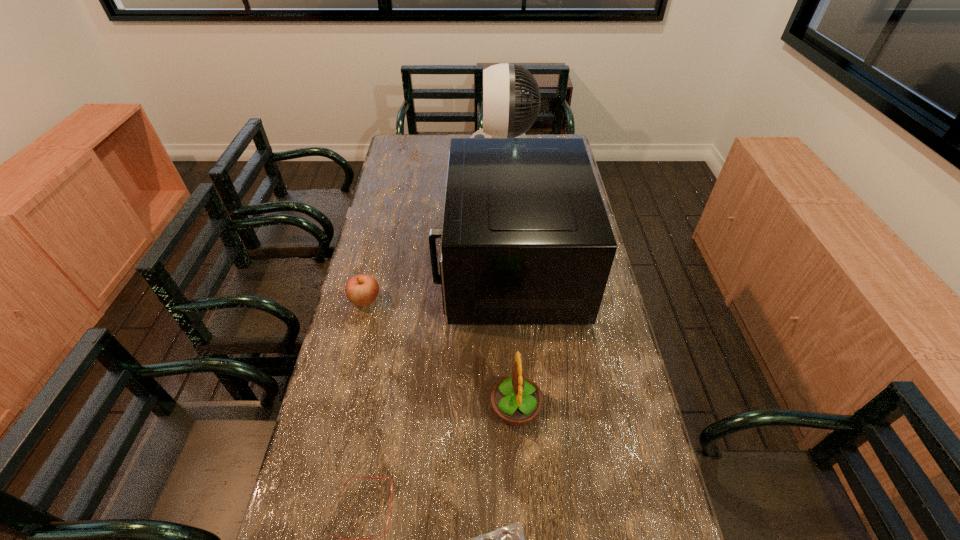
The height and width of the screenshot is (540, 960). I want to click on object at the far right corner, so click(x=501, y=101).

Where is `free location at the left edge of the desktop`? free location at the left edge of the desktop is located at coordinates (369, 487).

Locate an element on the screen. The height and width of the screenshot is (540, 960). vacant space that is in between the fourth tallest object and the fourth farthest object is located at coordinates (441, 354).

Find the location of a particular element. This screenshot has width=960, height=540. the third closest object to the leftmost object is located at coordinates 358,539.

Where is `the fourth closest object to the fan`? the fourth closest object to the fan is located at coordinates (358, 539).

Identify the location of vacant area in the image that satisfies the following two spatial constraints: 1. on the grille of the farthest object; 2. on the front side of the leftmost object. The image size is (960, 540). (512, 300).